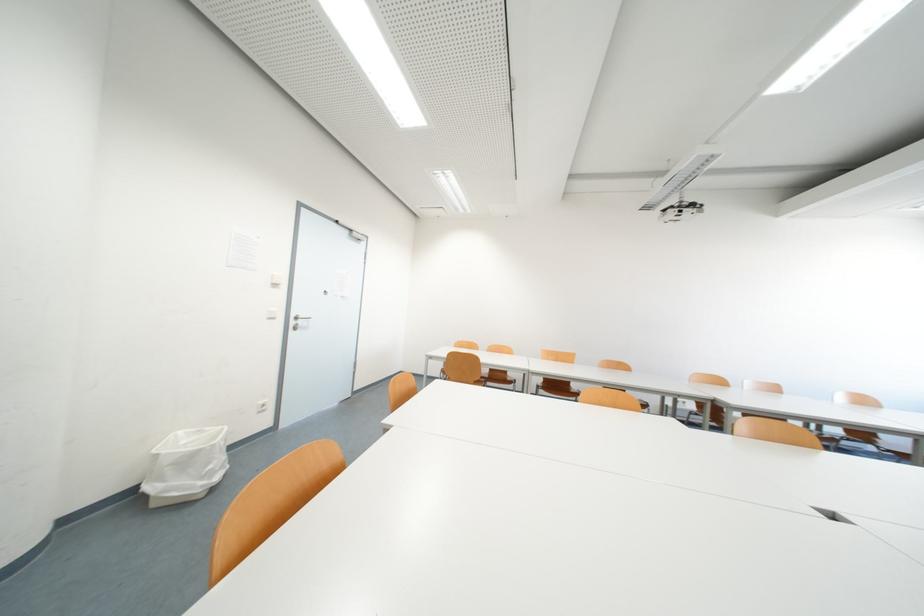
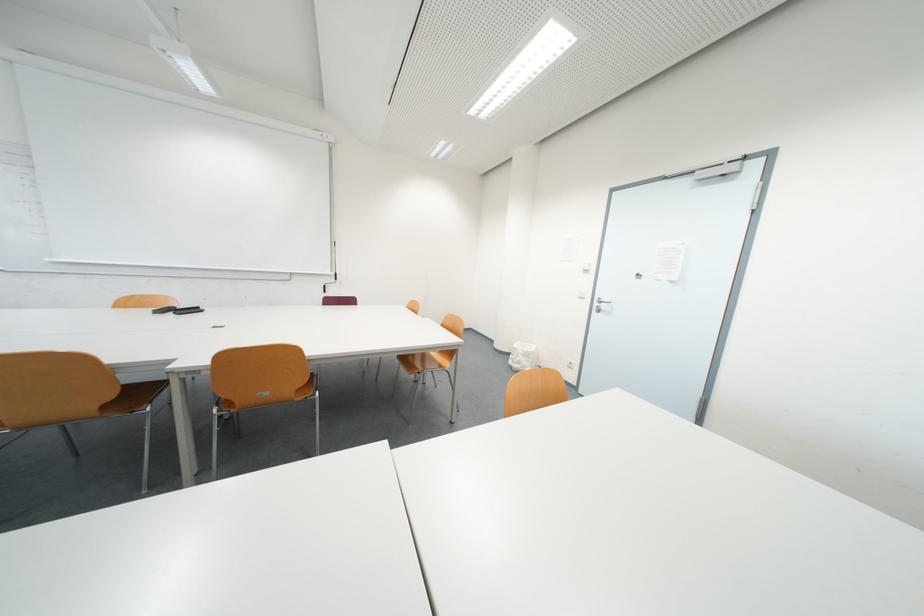
Find the pixel in the second image that matches the point at 302,323 in the first image.

(605, 305)